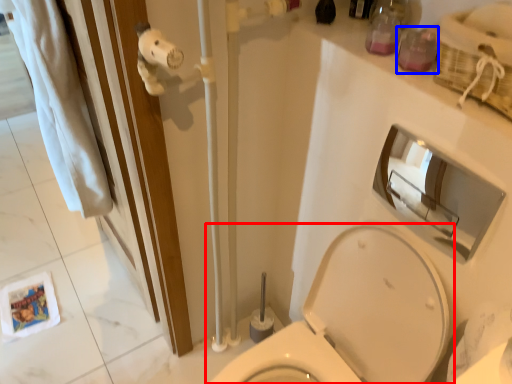
Question: Which object is further to the camera taking this photo, toilet (highlighted by a red box) or toiletry (highlighted by a blue box)?

Choices:
 (A) toilet
 (B) toiletry

Answer: (B)